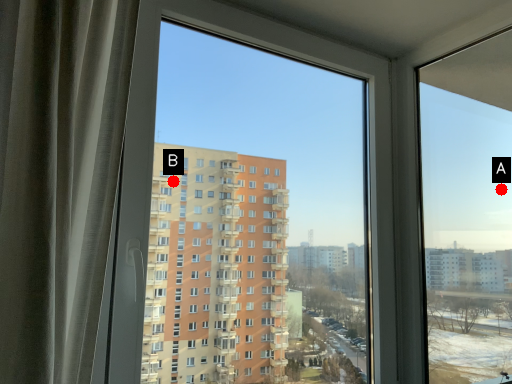
Question: Two points are circled on the image, labeled by A and B beside each circle. Which point is closer to the camera?

Choices:
 (A) A is closer
 (B) B is closer

Answer: (A)